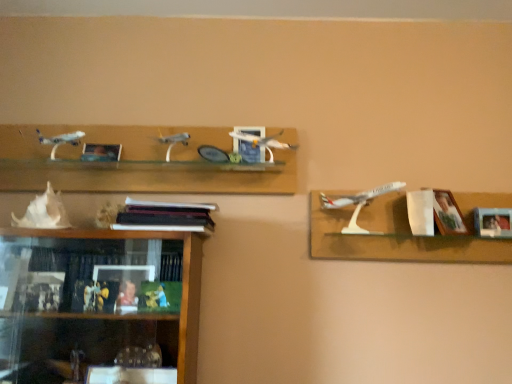
Question: Are wooden picture frame at right, the 2th picture frame positioned from the right, and white plastic airplane at right located far from each other?

Choices:
 (A) yes
 (B) no

Answer: (B)

Question: Can you confirm if wooden picture frame at right, the 2th picture frame positioned from the right, is thinner than white plastic airplane at right?

Choices:
 (A) no
 (B) yes

Answer: (B)

Question: Could you tell me if wooden picture frame at right, placed as the 3th picture frame when sorted from left to right, is turned towards white plastic airplane at right?

Choices:
 (A) yes
 (B) no

Answer: (A)

Question: From the image's perspective, would you say wooden picture frame at right, the 2th picture frame positioned from the right, is shown under white plastic airplane at right?

Choices:
 (A) no
 (B) yes

Answer: (A)

Question: Can you confirm if wooden picture frame at right, placed as the 3th picture frame when sorted from left to right, is taller than white plastic airplane at right?

Choices:
 (A) no
 (B) yes

Answer: (A)

Question: Is black matte bookshelf at center taller or shorter than matte blue picture frame at center, the 3th picture frame in the right-to-left sequence?

Choices:
 (A) short
 (B) tall

Answer: (A)

Question: From the image's perspective, is black matte bookshelf at center positioned above or below matte blue picture frame at center, marked as the 2th picture frame in a left-to-right arrangement?

Choices:
 (A) below
 (B) above

Answer: (A)

Question: From a real-world perspective, is black matte bookshelf at center physically located above or below matte blue picture frame at center, marked as the 2th picture frame in a left-to-right arrangement?

Choices:
 (A) above
 (B) below

Answer: (B)

Question: Is black matte bookshelf at center in front of or behind matte blue picture frame at center, the 3th picture frame in the right-to-left sequence, in the image?

Choices:
 (A) behind
 (B) front

Answer: (B)

Question: From a real-world perspective, is matte blue picture frame at center, marked as the 2th picture frame in a left-to-right arrangement, above or below matte wooden picture frame at upper center, placed as the 4th picture frame when sorted from right to left?

Choices:
 (A) below
 (B) above

Answer: (B)

Question: Based on their sizes in the image, would you say matte blue picture frame at center, the 3th picture frame in the right-to-left sequence, is bigger or smaller than matte wooden picture frame at upper center, the first picture frame from the left?

Choices:
 (A) small
 (B) big

Answer: (B)

Question: Is matte blue picture frame at center, the 3th picture frame in the right-to-left sequence, situated inside matte wooden picture frame at upper center, placed as the 4th picture frame when sorted from right to left, or outside?

Choices:
 (A) outside
 (B) inside

Answer: (A)

Question: Based on their positions, is matte blue picture frame at center, marked as the 2th picture frame in a left-to-right arrangement, located to the left or right of matte wooden picture frame at upper center, the first picture frame from the left?

Choices:
 (A) right
 (B) left

Answer: (A)

Question: Is point (494, 236) closer or farther from the camera than point (102, 158)?

Choices:
 (A) farther
 (B) closer

Answer: (B)

Question: From a real-world perspective, is wooden photo frame at right, arranged as the 1th picture frame when viewed from the right, positioned above or below matte wooden picture frame at upper center, the first picture frame from the left?

Choices:
 (A) below
 (B) above

Answer: (A)